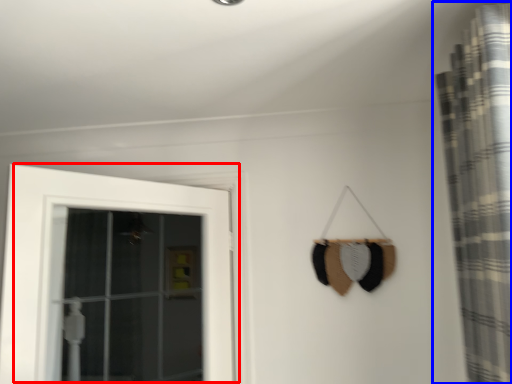
Question: Which object is closer to the camera taking this photo, door (highlighted by a red box) or curtain (highlighted by a blue box)?

Choices:
 (A) door
 (B) curtain

Answer: (B)